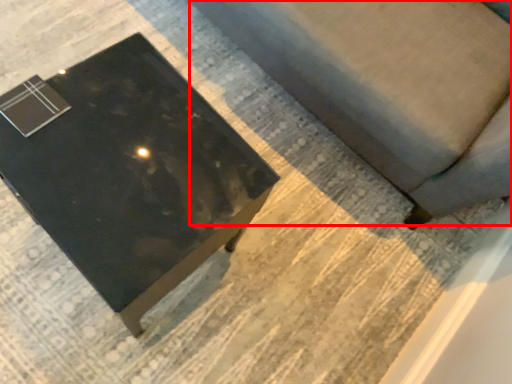
Question: Where is couch (annotated by the red box) located in relation to table in the image?

Choices:
 (A) right
 (B) left

Answer: (A)